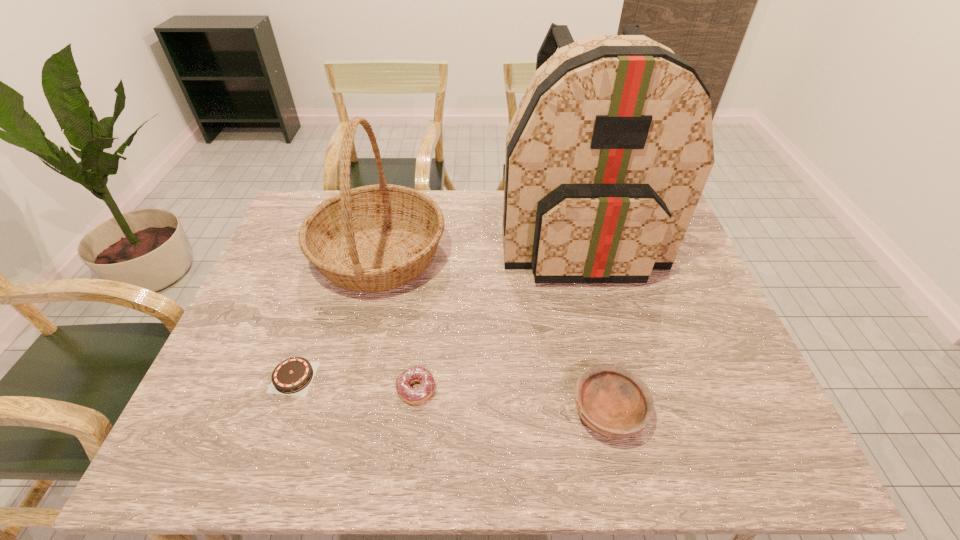
Locate an element on the screen. vacant area at the right edge of the desktop is located at coordinates (731, 363).

This screenshot has width=960, height=540. In the image, there is a desktop. What are the coordinates of `vacant region at the near right corner` in the screenshot? It's located at (711, 431).

The height and width of the screenshot is (540, 960). Identify the location of vacant area that lies between the fourth shortest object and the backpack. (479, 245).

Locate an element on the screen. The image size is (960, 540). vacant space in between the chocolate cake and the tallest object is located at coordinates (436, 306).

I want to click on vacant region between the shortest object and the tallest object, so click(x=436, y=306).

Where is `unoccupied position between the basket and the fourth tallest object`? This screenshot has height=540, width=960. unoccupied position between the basket and the fourth tallest object is located at coordinates (397, 322).

You are a GUI agent. You are given a task and a screenshot of the screen. Output one action in this format:
    pyautogui.click(x=<x>, y=<y>)
    Task: Click on the vacant area that lies between the basket and the tallest object
    This screenshot has width=960, height=540.
    Given the screenshot: What is the action you would take?
    click(479, 245)

Locate an element on the screen. This screenshot has height=540, width=960. unoccupied area between the third tallest object and the doughnut is located at coordinates (513, 401).

This screenshot has height=540, width=960. I want to click on vacant area that lies between the basket and the shortest object, so click(x=336, y=316).

The width and height of the screenshot is (960, 540). What are the coordinates of `empty space between the second shortest object and the third shortest object` in the screenshot? It's located at (513, 401).